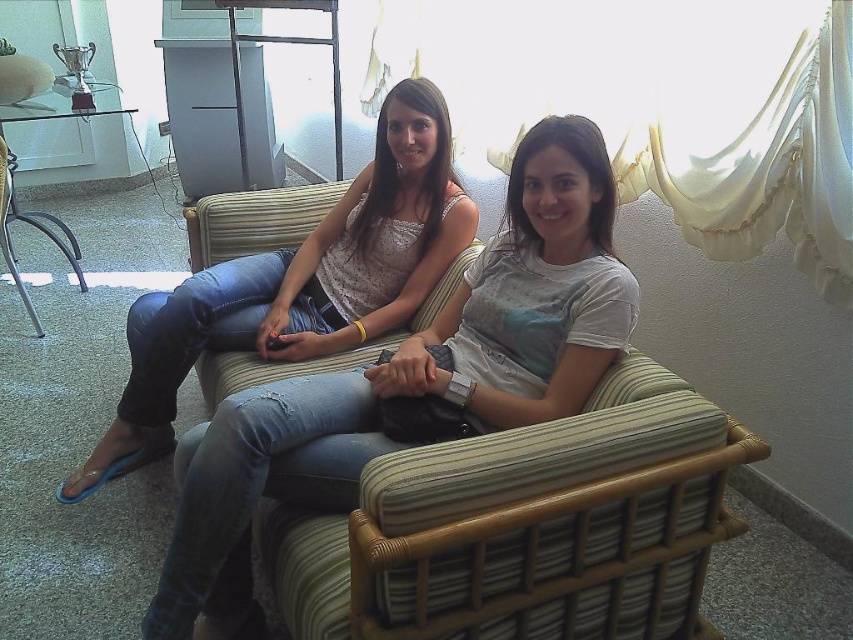
You are a fashion designer observing the two individuals on the striped wicker sofa. You need to determine which clothing item is positioned lower on their bodies between the denim jeans at center and the matte white tank top at center. Which one is lower?

The denim jeans at center is below matte white tank top at center, so the denim jeans at center is positioned lower on their bodies.

You are a photographer adjusting your camera settings to focus on the denim jeans at center and the matte white tank top at center. Which object should you focus on first to ensure both are in sharp focus?

You should focus on the denim jeans at center first since it is closer to the viewer than the matte white tank top at center. By focusing on the closer object, the depth of field may also keep the matte white tank top at center in focus.